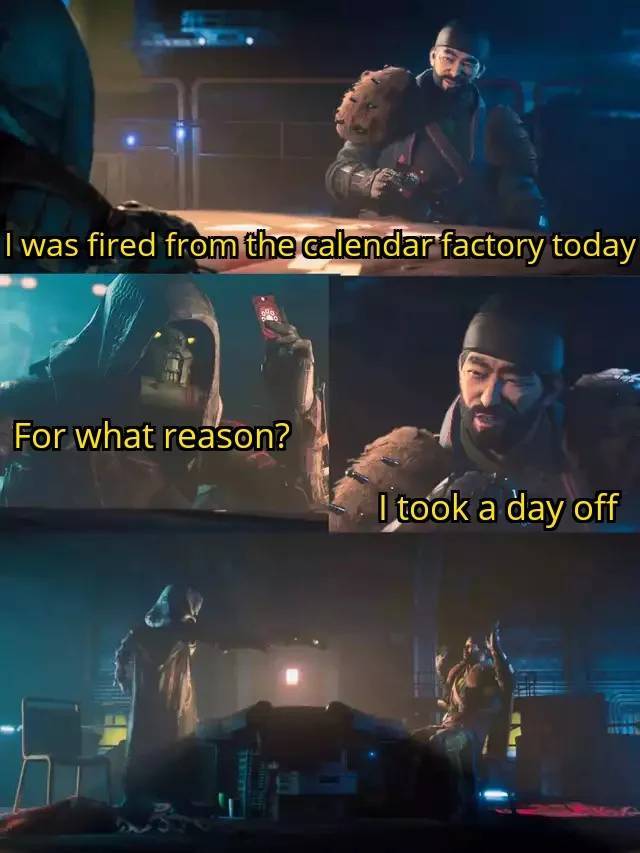
Identify the location of chair legs. This screenshot has height=853, width=640. (20, 768), (45, 776), (77, 780), (106, 778).